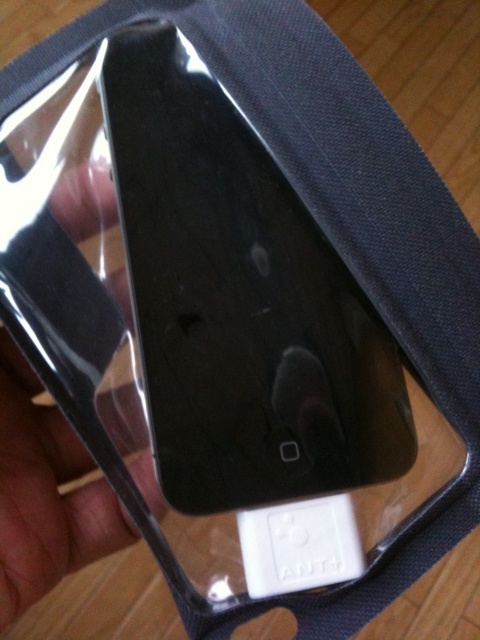
Is the position of transparent plastic hand at center more distant than that of white plastic ipod at center?

No, transparent plastic hand at center is in front of white plastic ipod at center.

Who is positioned more to the left, transparent plastic hand at center or white plastic ipod at center?

Positioned to the left is transparent plastic hand at center.

Does point (35, 577) come closer to viewer compared to point (276, 593)?

That is True.

Find the location of a particular element. The height and width of the screenshot is (640, 480). transparent plastic hand at center is located at coordinates click(46, 493).